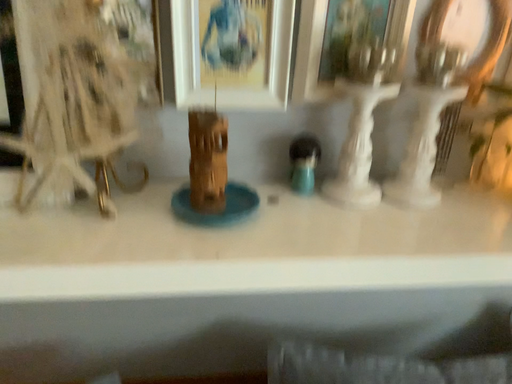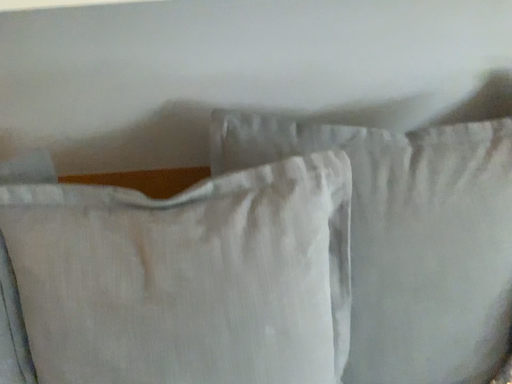
Question: Which way did the camera rotate in the video?

Choices:
 (A) rotated downward
 (B) rotated upward

Answer: (A)